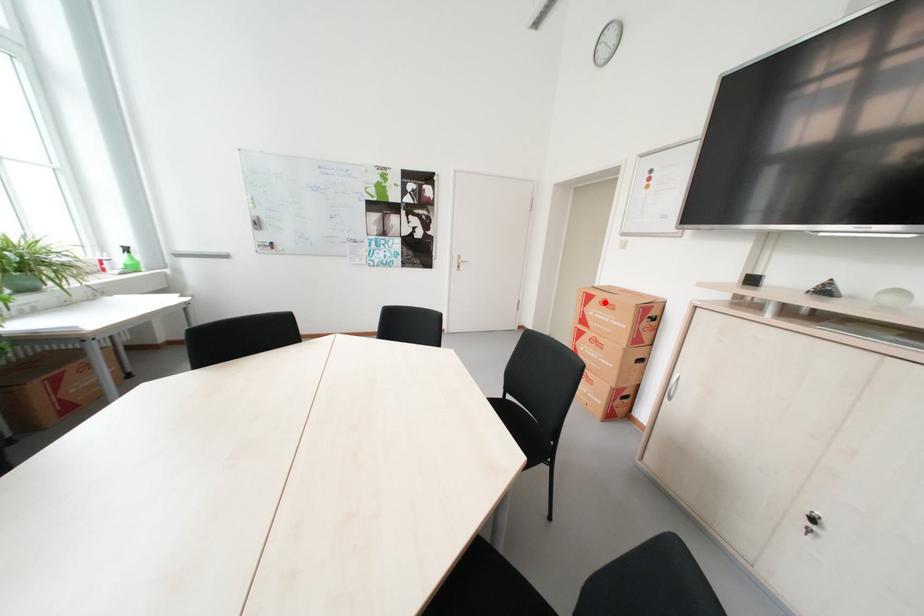
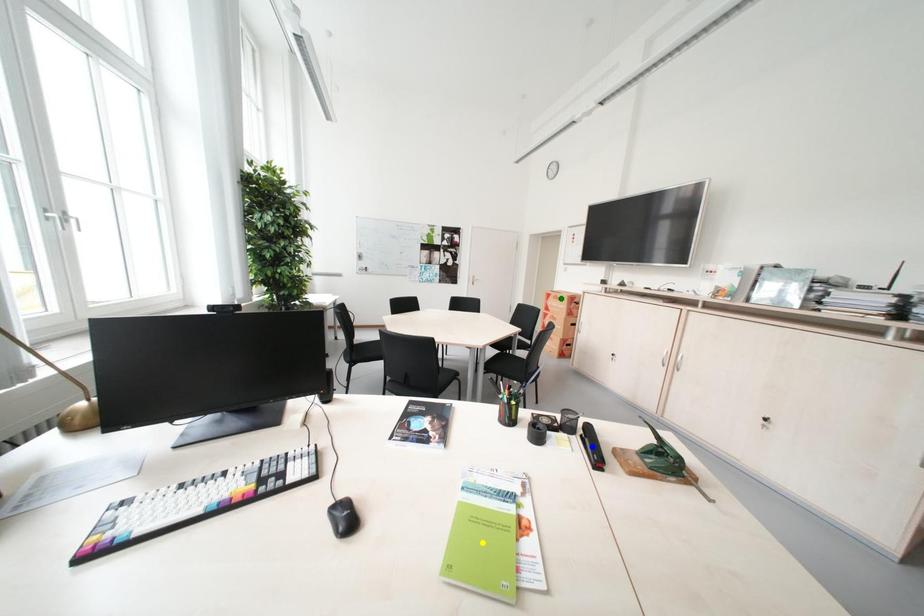
Question: I am providing you with two images of the same scene from different viewpoints. A red point is marked on the first image. You are given multiple points on the second image. Which spot in image 2 lines up with the point in image 1?

Choices:
 (A) yellow point
 (B) blue point
 (C) green point

Answer: (C)